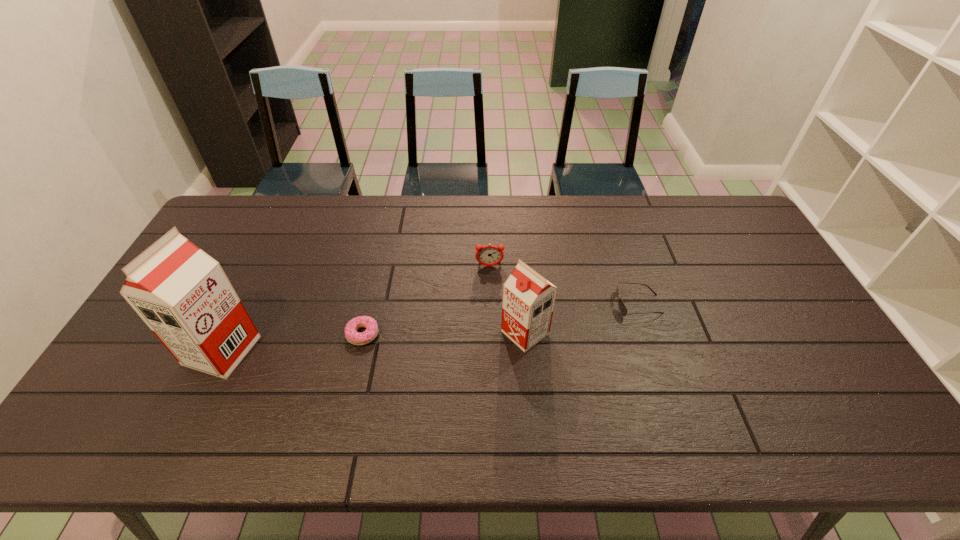
Identify the location of vacant space located 0.220m on the back of the tallest object. (261, 269).

The width and height of the screenshot is (960, 540). I want to click on vacant space located on the right of the right soya milk, so click(668, 333).

Locate an element on the screen. The height and width of the screenshot is (540, 960). free point located on the front-facing side of the farthest object is located at coordinates (490, 296).

The width and height of the screenshot is (960, 540). What are the coordinates of `free space located 0.170m on the back of the doughnut` in the screenshot? It's located at (375, 278).

Identify the location of free location located on the front-facing side of the sunglasses. (575, 305).

You are a GUI agent. You are given a task and a screenshot of the screen. Output one action in this format:
    pyautogui.click(x=<x>, y=<y>)
    Task: Click on the vacant area situated on the front-facing side of the sunglasses
    
    Given the screenshot: What is the action you would take?
    pyautogui.click(x=562, y=305)

The width and height of the screenshot is (960, 540). What are the coordinates of `vacant region located 0.220m on the front-facing side of the sunglasses` in the screenshot? It's located at (540, 305).

Find the location of a particular element. The height and width of the screenshot is (540, 960). object that is positioned at the near edge is located at coordinates (183, 295).

At what (x,y) coordinates should I click in order to perform the action: click on object present at the left edge. Please return your answer as a coordinate pair (x, y). Image resolution: width=960 pixels, height=540 pixels. Looking at the image, I should click on (183, 295).

This screenshot has width=960, height=540. Identify the location of object located in the near left corner section of the desktop. (183, 295).